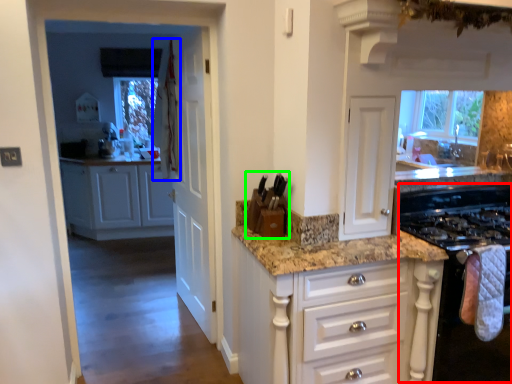
Question: Which object is positioned closest to appliance (highlighted by a red box)? Select from curtain (highlighted by a blue box) and appliance (highlighted by a green box).

Choices:
 (A) curtain
 (B) appliance

Answer: (B)